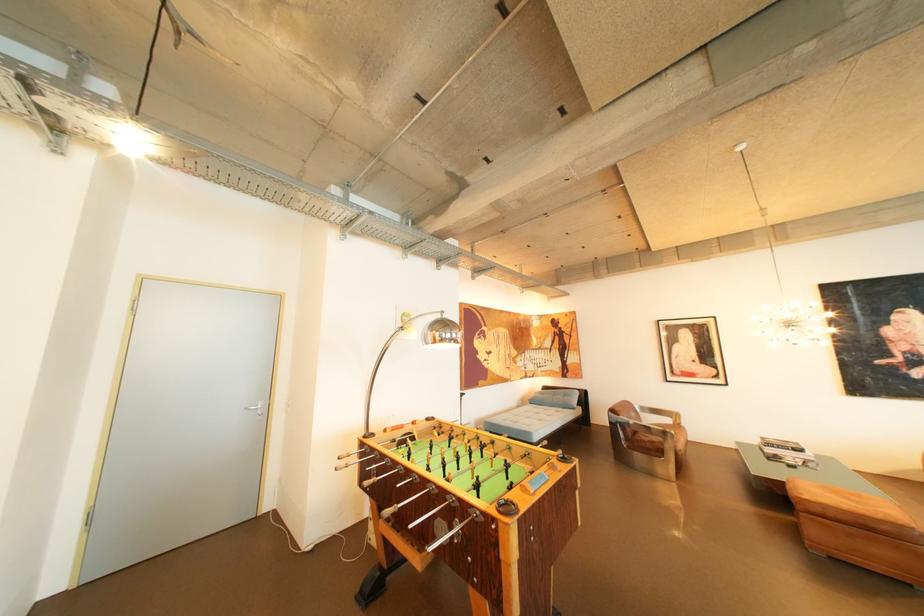
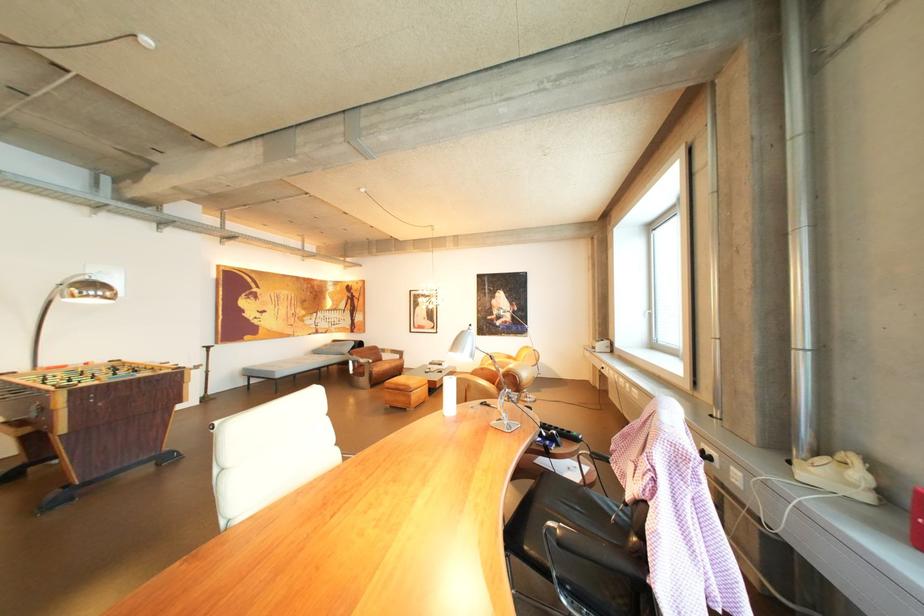
The point at (463, 336) is marked in the first image. Where is the corresponding point in the second image?

(105, 294)